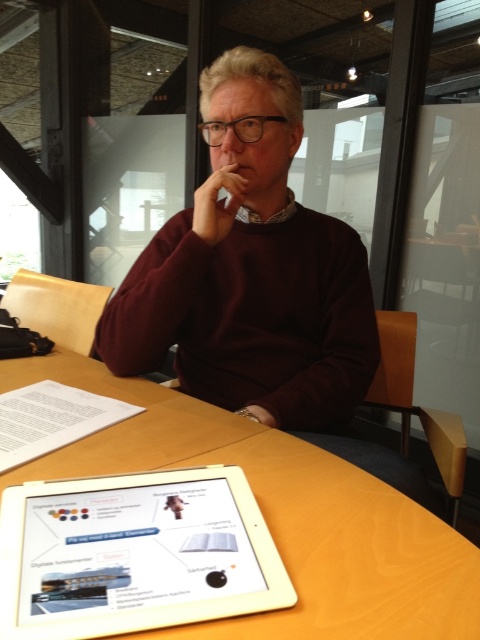
You are an interior designer planning to place a new lamp on the wooden table at center. Considering the maroon sweater at center is already there, where should you place the lamp to avoid overlapping with the sweater?

The maroon sweater at center is positioned on the right side of the wooden table at center, so placing the lamp on the left side of the wooden table at center would avoid overlapping with the sweater.

You are a photographer trying to capture a clear photo of the white glossy tablet at center. However, the maroon sweater at center is blocking your view. Can you move the sweater to take the photo?

The maroon sweater at center is positioned over the white glossy tablet at center, so you need to move the maroon sweater at center to take a clear photo of the white glossy tablet at center.

You are an assistant in a meeting room. The presenter is wearing a maroon sweater at center and has a white glossy tablet at center. Which object is positioned to the left?

The white glossy tablet at center is to the left of the maroon sweater at center.